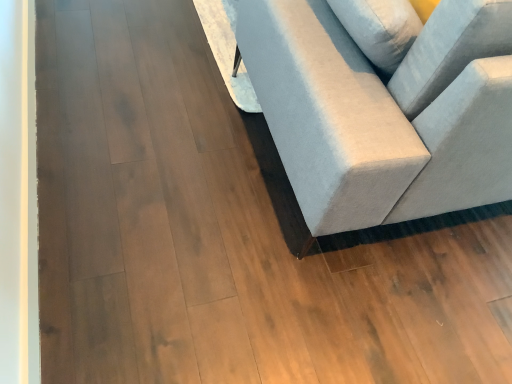
Question: Should I look upward or downward to see light gray fabric couch at right?

Choices:
 (A) up
 (B) down

Answer: (A)